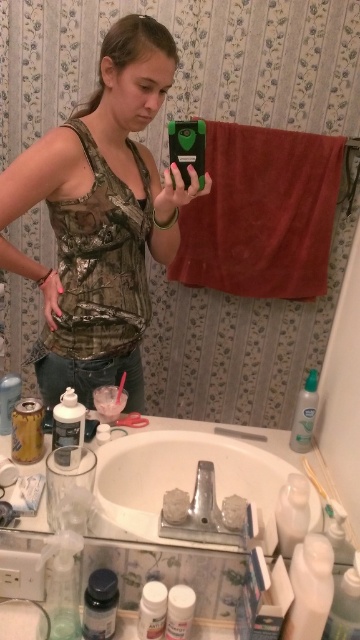
You are organizing the bathroom and need to place a new decorative vase that is 15 cm tall. The white ceramic sink at center and the white plastic toothbrush at lower right are in the scene. Which object can the vase be placed on top of without it being too unstable?

The white ceramic sink at center is much taller than the white plastic toothbrush at lower right, so placing the vase on the sink would provide a stable base due to its height and sturdiness compared to the toothbrush.

You are standing in a bathroom and want to place a 12 inch tall decorative vase on the white ceramic sink at center. Based on the scene description, can you determine if the sink is tall enough to accommodate the vase?

The white ceramic sink at center and viewer are 34.06 inches apart from each other, but this distance does not indicate the sink height. Without knowing the sink height, it is impossible to determine if it can hold a 12 inch tall vase.

You are organizing the bathroom sink and need to place the white plastic toothbrush at lower right and the white plastic bottle at lower center. According to the current arrangement, which item is positioned to the right side?

The white plastic toothbrush at lower right is positioned to the right of the white plastic bottle at lower center, so the toothbrush is on the right side.